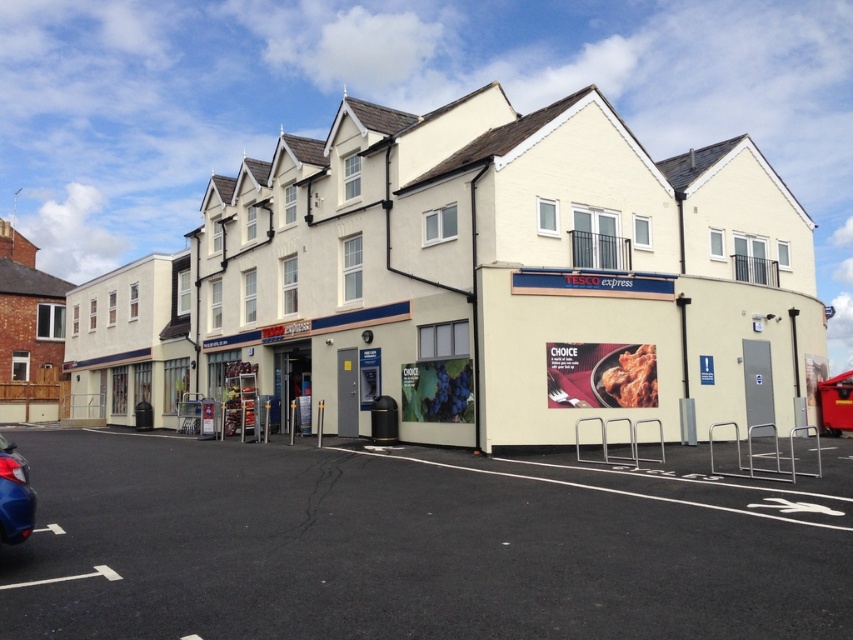
Is the position of black asphalt parking lot at lower center less distant than that of metallic blue car at lower left?

Yes.

Is point (316, 614) closer to camera compared to point (4, 461)?

Yes, it is in front of point (4, 461).

Identify the location of black asphalt parking lot at lower center. This screenshot has height=640, width=853. (416, 545).

In order to click on black asphalt parking lot at lower center in this screenshot , I will do `click(416, 545)`.